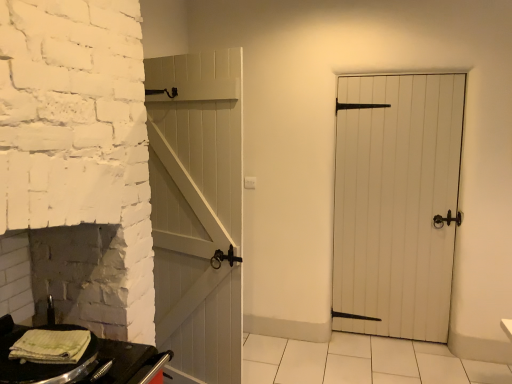
Question: Looking at the image, does white wooden door at center seem bigger or smaller compared to black matte table at lower left?

Choices:
 (A) small
 (B) big

Answer: (B)

Question: From a real-world perspective, is white wooden door at center above or below black matte table at lower left?

Choices:
 (A) below
 (B) above

Answer: (B)

Question: Based on their relative distances, which object is nearer to the green striped towel at lower left?

Choices:
 (A) white wooden door at center
 (B) black matte table at lower left

Answer: (B)

Question: Which of these objects is positioned farthest from the green striped towel at lower left?

Choices:
 (A) black matte table at lower left
 (B) white wooden door at center

Answer: (B)